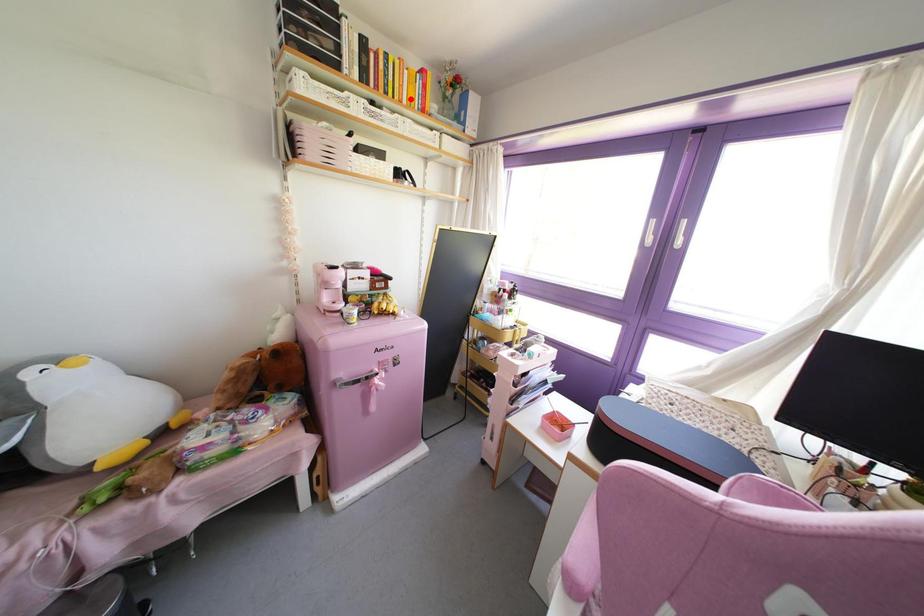
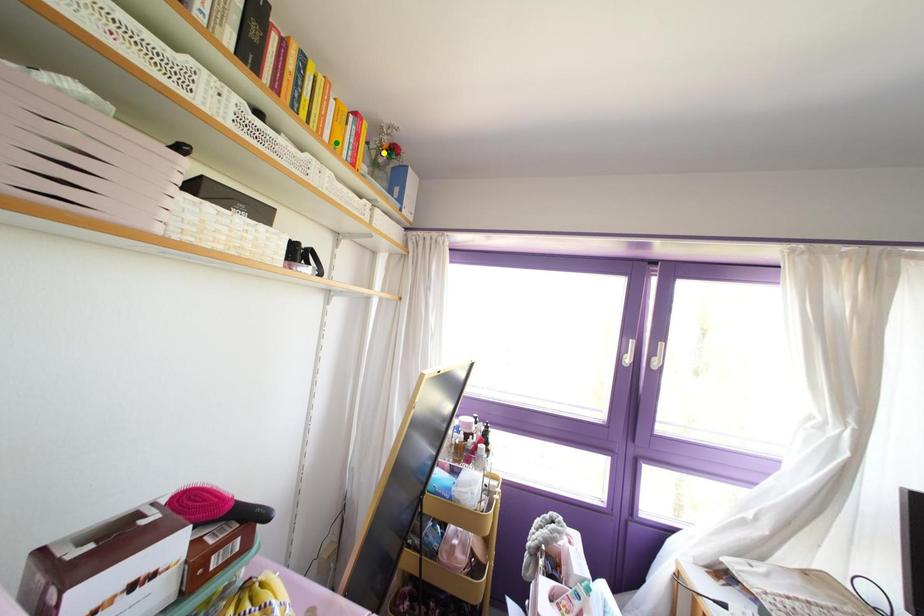
Question: I am providing you with two images of the same scene from different viewpoints. A red point is marked on the first image. You are given multiple points on the second image. In image 2, which mark is for the same physical point as the one in image 1?

Choices:
 (A) blue point
 (B) green point
 (C) yellow point

Answer: (B)